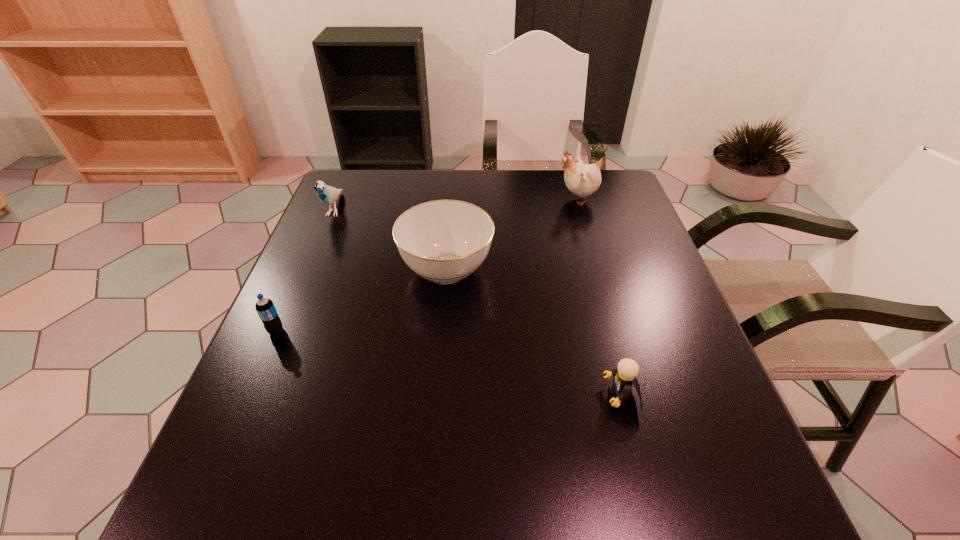
I want to click on object that is at the far right corner, so click(x=581, y=179).

Where is `blank area at the far edge`? Image resolution: width=960 pixels, height=540 pixels. blank area at the far edge is located at coordinates (416, 177).

This screenshot has width=960, height=540. In the image, there is a desktop. In order to click on free space at the left edge in this screenshot , I will do `click(313, 418)`.

Identify the location of vacant space at the right edge of the desktop. This screenshot has height=540, width=960. (612, 263).

In order to click on vacant space at the far left corner of the desktop in this screenshot , I will do `click(381, 194)`.

What are the coordinates of `vacant region at the far right corner of the desktop` in the screenshot? It's located at (630, 199).

Where is `free space that is in between the third farthest object and the second nearest object`? This screenshot has width=960, height=540. free space that is in between the third farthest object and the second nearest object is located at coordinates (361, 300).

The height and width of the screenshot is (540, 960). I want to click on vacant area that lies between the right bird and the Lego, so (x=599, y=298).

This screenshot has height=540, width=960. Find the location of `free space that is in between the right bird and the third nearest object`. free space that is in between the right bird and the third nearest object is located at coordinates (513, 234).

Locate an element on the screen. The height and width of the screenshot is (540, 960). free space that is in between the fourth farthest object and the third object from right to left is located at coordinates [x=361, y=300].